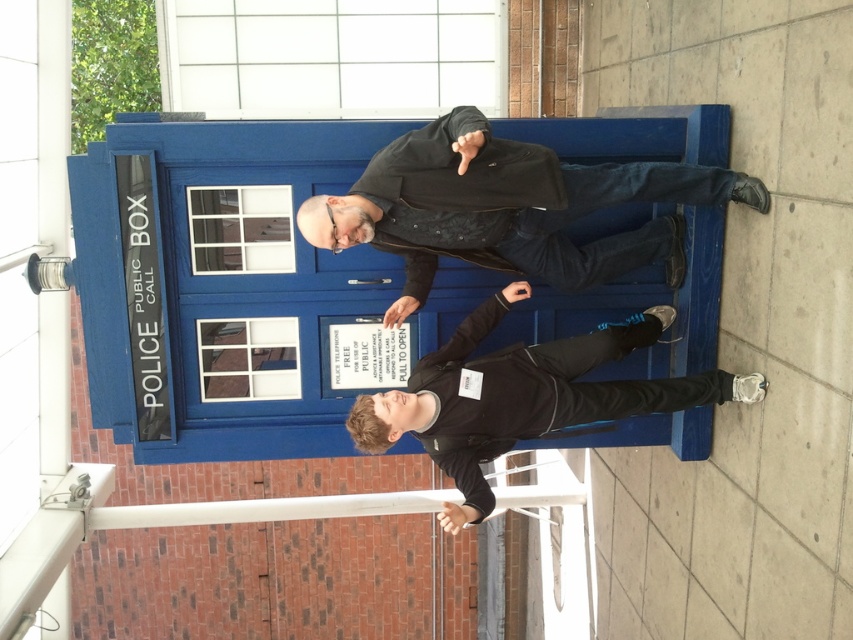
Question: Is matte black jacket at center positioned in front of black matte jacket at center?

Choices:
 (A) yes
 (B) no

Answer: (A)

Question: Among these objects, which one is farthest from the camera?

Choices:
 (A) black matte jacket at center
 (B) matte black jacket at center

Answer: (A)

Question: Is matte black jacket at center wider than black matte jacket at center?

Choices:
 (A) yes
 (B) no

Answer: (A)

Question: Observing the image, what is the correct spatial positioning of matte black jacket at center in reference to black matte jacket at center?

Choices:
 (A) left
 (B) right

Answer: (A)